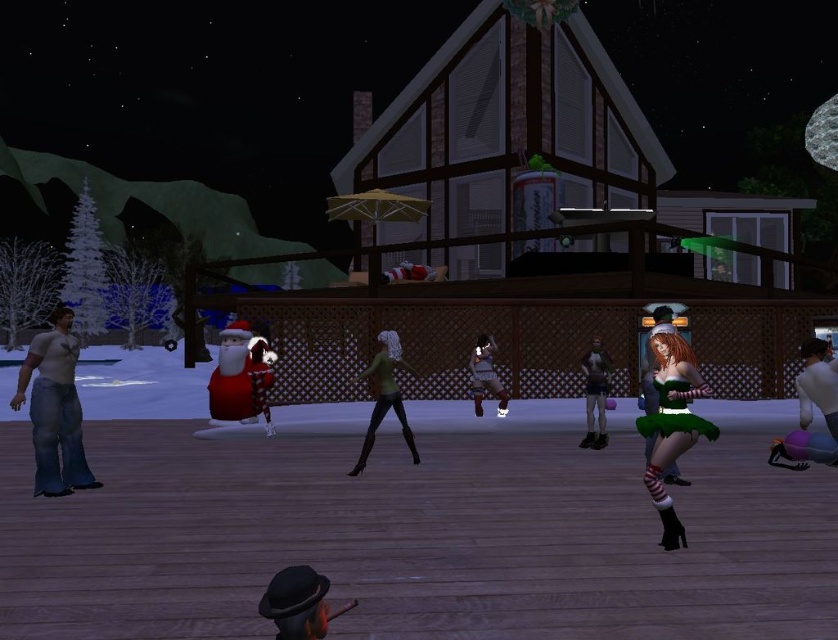
Question: Which point is farther to the camera?

Choices:
 (A) (278, 589)
 (B) (233, 348)
 (C) (818, 392)

Answer: (B)

Question: Which of the following is the closest to the observer?

Choices:
 (A) click(x=27, y=378)
 (B) click(x=293, y=609)

Answer: (B)

Question: Which of the following is the farthest from the observer?

Choices:
 (A) (639, 428)
 (B) (803, 410)
 (C) (477, 404)
 (D) (296, 573)

Answer: (C)

Question: Is jeans at left further to the viewer compared to red plush santa at left?

Choices:
 (A) yes
 (B) no

Answer: (B)

Question: Is green satin dress at right to the right of shiny brown dress at center from the viewer's perspective?

Choices:
 (A) no
 (B) yes

Answer: (B)

Question: Can you confirm if green matte leggings at center is positioned to the left of green satin dress at center?

Choices:
 (A) yes
 (B) no

Answer: (A)